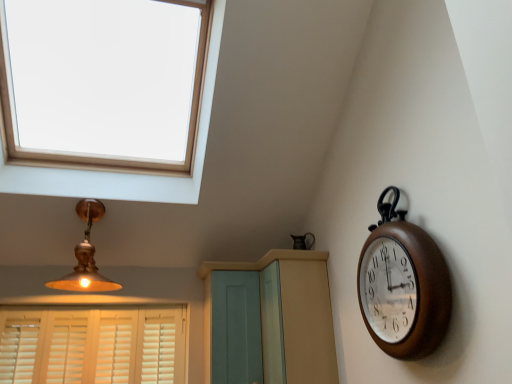
Question: Considering the relative sizes of brown wooden clock at right and matte gold lampshade at upper left in the image provided, is brown wooden clock at right taller than matte gold lampshade at upper left?

Choices:
 (A) no
 (B) yes

Answer: (B)

Question: From a real-world perspective, is brown wooden clock at right beneath matte gold lampshade at upper left?

Choices:
 (A) yes
 (B) no

Answer: (A)

Question: Considering the relative sizes of brown wooden clock at right and matte gold lampshade at upper left in the image provided, is brown wooden clock at right thinner than matte gold lampshade at upper left?

Choices:
 (A) yes
 (B) no

Answer: (A)

Question: Does brown wooden clock at right lie behind matte gold lampshade at upper left?

Choices:
 (A) yes
 (B) no

Answer: (B)

Question: Does brown wooden clock at right have a larger size compared to matte gold lampshade at upper left?

Choices:
 (A) no
 (B) yes

Answer: (A)

Question: Is brown wooden clock at right closer to camera compared to matte gold lampshade at upper left?

Choices:
 (A) yes
 (B) no

Answer: (A)

Question: Is light blue wood dresser at center far away from white wood blinds at lower left?

Choices:
 (A) no
 (B) yes

Answer: (B)

Question: From a real-world perspective, is light blue wood dresser at center on top of white wood blinds at lower left?

Choices:
 (A) no
 (B) yes

Answer: (B)

Question: Can you see light blue wood dresser at center touching white wood blinds at lower left?

Choices:
 (A) no
 (B) yes

Answer: (A)

Question: From the image's perspective, would you say light blue wood dresser at center is positioned over white wood blinds at lower left?

Choices:
 (A) yes
 (B) no

Answer: (A)

Question: Does light blue wood dresser at center have a lesser width compared to white wood blinds at lower left?

Choices:
 (A) yes
 (B) no

Answer: (B)

Question: Can you confirm if light blue wood dresser at center is smaller than white wood blinds at lower left?

Choices:
 (A) no
 (B) yes

Answer: (A)

Question: From a real-world perspective, is light blue wood screen door at center located higher than white wood blinds at lower left?

Choices:
 (A) no
 (B) yes

Answer: (B)